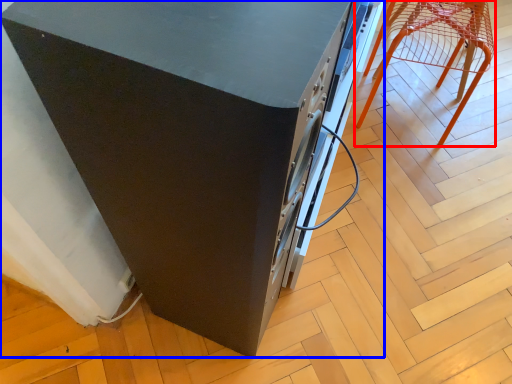
Question: Which point is closer to the camera, furniture (highlighted by a red box) or home appliance (highlighted by a blue box)?

Choices:
 (A) furniture
 (B) home appliance

Answer: (B)